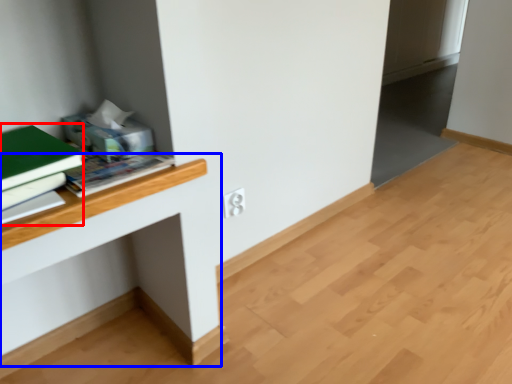
Question: Among these objects, which one is nearest to the camera, paperback book (highlighted by a red box) or computer desk (highlighted by a blue box)?

Choices:
 (A) paperback book
 (B) computer desk

Answer: (A)